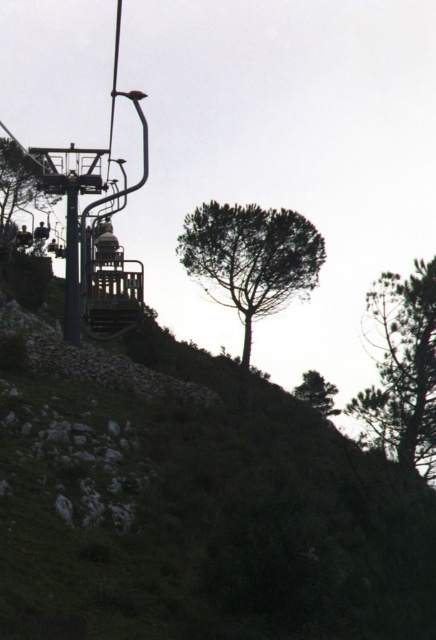
From the picture: You are a hiker trying to navigate through the mountainous area. You see the green leafy tree at center and the green leafy tree at upper center. Which tree would you choose as a landmark if you want to mark a wider path? Explain your choice based on their sizes.

The green leafy tree at center has a greater width than the green leafy tree at upper center, so it would be a better landmark for marking a wider path since its larger size makes it more noticeable and indicative of a broader area.

You are a hiker planning to navigate from the starting point at point (40, 204) to the destination at point (330, 404). Based on the scene description, which point is closer to you as you begin your hike?

Point (330, 404) is closer to you because the description states that point (40, 204) is behind point (330, 404), meaning the latter is nearer to your starting position.

You are a hiker trying to navigate the mountain trail. You see two green leafy trees ahead. Which tree is closer to the ground, the green leafy tree at center or the green leafy tree at upper center?

The green leafy tree at center is closer to the ground because it is positioned below the green leafy tree at upper center.